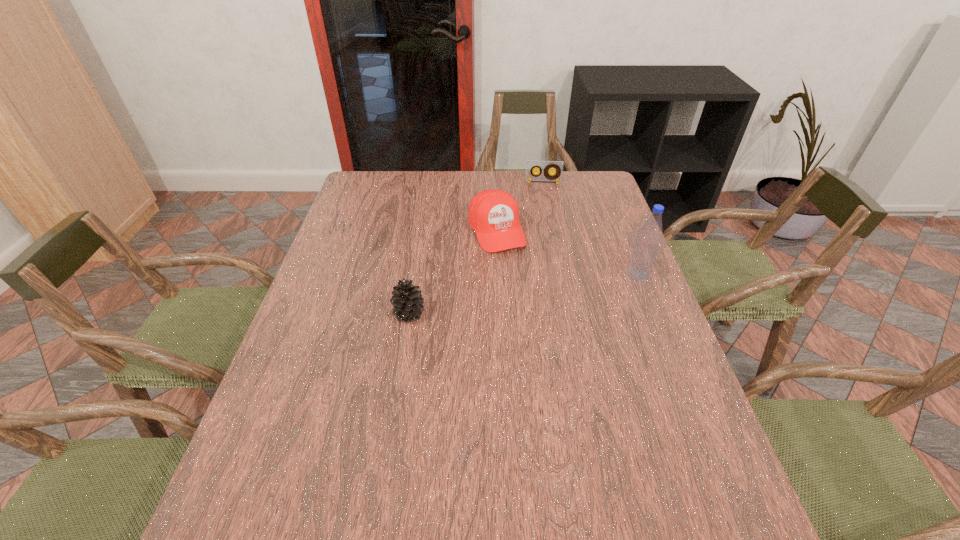
Image resolution: width=960 pixels, height=540 pixels. I want to click on free space between the rightmost object and the third object from right to left, so click(x=567, y=252).

I want to click on free space between the third nearest object and the shortest object, so click(519, 207).

Where is `empty space between the second object from right to left and the leftmost object`? The height and width of the screenshot is (540, 960). empty space between the second object from right to left and the leftmost object is located at coordinates (476, 248).

The width and height of the screenshot is (960, 540). I want to click on the closest object to the third nearest object, so click(x=531, y=165).

Locate which object ranks third in proximity to the leftmost object. Please provide its 2D coordinates. Your answer should be formatted as a tuple, i.e. [(x, y)], where the tuple contains the x and y coordinates of a point satisfying the conditions above.

[(531, 165)]

Locate an element on the screen. The image size is (960, 540). free space that satisfies the following two spatial constraints: 1. on the back side of the nearest object; 2. on the right side of the baseball cap is located at coordinates (422, 231).

Find the location of a particular element. The height and width of the screenshot is (540, 960). vacant point that satisfies the following two spatial constraints: 1. on the back side of the leftmost object; 2. on the left side of the tallest object is located at coordinates (416, 274).